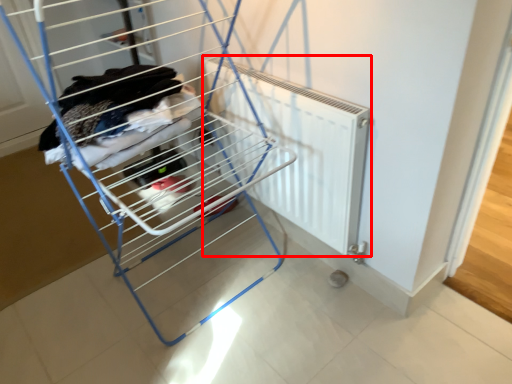
Question: Observing the image, what is the correct spatial positioning of radiator (annotated by the red box) in reference to furniture?

Choices:
 (A) left
 (B) right

Answer: (B)